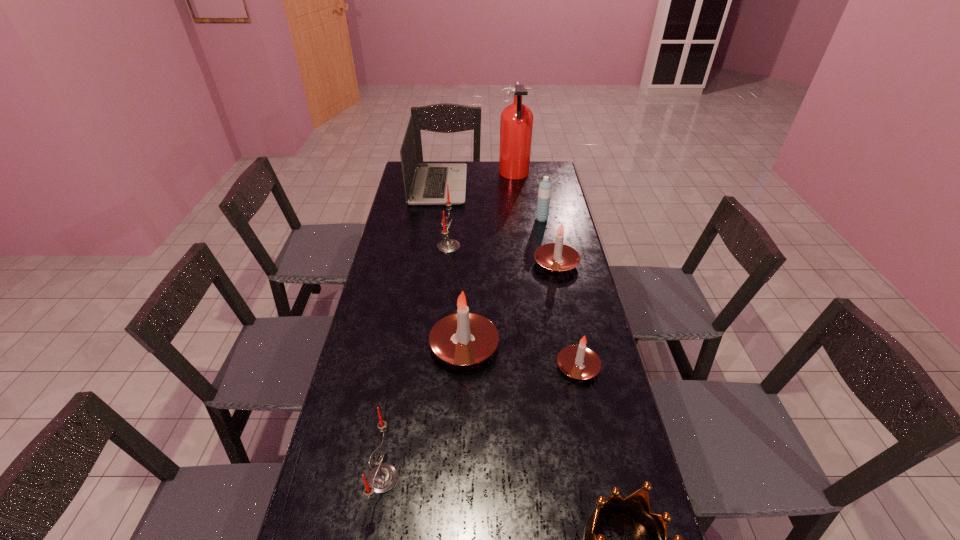
Where is `vacant space at the right edge of the desktop`? vacant space at the right edge of the desktop is located at coordinates (569, 231).

Locate an element on the screen. vacant space at the far right corner of the desktop is located at coordinates (554, 173).

Identify the location of free space between the leftmost white candle and the blue water bottle. (503, 282).

What are the coordinates of `free spot between the farthest white candle and the right red candle` in the screenshot? It's located at (502, 255).

This screenshot has height=540, width=960. I want to click on unoccupied area between the shortest object and the leftmost white candle, so click(x=521, y=356).

Locate an element on the screen. the second closest object to the laptop computer is located at coordinates (447, 245).

The height and width of the screenshot is (540, 960). What are the coordinates of `object that can be found as the eighth closest to the smaller red candle` in the screenshot? It's located at (516, 124).

Identify which candle is the second closest to the leftmost white candle. Please provide its 2D coordinates. Your answer should be formatted as a tuple, i.e. [(x, y)], where the tuple contains the x and y coordinates of a point satisfying the conditions above.

[(382, 478)]

Locate which candle ranks fourth in proximity to the crown. Please provide its 2D coordinates. Your answer should be formatted as a tuple, i.e. [(x, y)], where the tuple contains the x and y coordinates of a point satisfying the conditions above.

[(557, 257)]

Identify which white candle is the third nearest to the second tallest object. Please provide its 2D coordinates. Your answer should be formatted as a tuple, i.e. [(x, y)], where the tuple contains the x and y coordinates of a point satisfying the conditions above.

[(577, 361)]